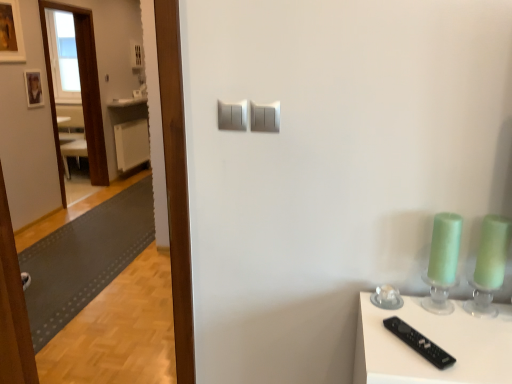
Question: Can you confirm if transparent wooden door at left is smaller than wooden picture frame at upper left, the 1th picture frame when ordered from front to back?

Choices:
 (A) yes
 (B) no

Answer: (B)

Question: Does transparent wooden door at left have a lesser width compared to wooden picture frame at upper left, the 1th picture frame when ordered from front to back?

Choices:
 (A) yes
 (B) no

Answer: (B)

Question: From the image's perspective, would you say transparent wooden door at left is shown under wooden picture frame at upper left, marked as the second picture frame in a bottom-to-top arrangement?

Choices:
 (A) yes
 (B) no

Answer: (A)

Question: Does transparent wooden door at left have a larger size compared to wooden picture frame at upper left, placed as the second picture frame when sorted from back to front?

Choices:
 (A) no
 (B) yes

Answer: (B)

Question: Considering the relative positions of transparent wooden door at left and wooden picture frame at upper left, the 1th picture frame when ordered from front to back, in the image provided, is transparent wooden door at left to the left of wooden picture frame at upper left, the 1th picture frame when ordered from front to back, from the viewer's perspective?

Choices:
 (A) yes
 (B) no

Answer: (B)

Question: Is wooden photo frame at upper left, the first picture frame ordered from the bottom, situated inside wooden picture frame at upper left, which is counted as the 1th picture frame, starting from the top, or outside?

Choices:
 (A) inside
 (B) outside

Answer: (B)

Question: Considering their positions, is wooden photo frame at upper left, the first picture frame ordered from the bottom, located in front of or behind wooden picture frame at upper left, placed as the second picture frame when sorted from back to front?

Choices:
 (A) behind
 (B) front

Answer: (A)

Question: From a real-world perspective, relative to wooden picture frame at upper left, which is counted as the 1th picture frame, starting from the top, is wooden photo frame at upper left, the first picture frame when ordered from back to front, vertically above or below?

Choices:
 (A) above
 (B) below

Answer: (B)

Question: Visually, is wooden photo frame at upper left, which ranks as the 2th picture frame in front-to-back order, positioned to the left or to the right of wooden picture frame at upper left, marked as the second picture frame in a bottom-to-top arrangement?

Choices:
 (A) right
 (B) left

Answer: (A)

Question: Is white plastic radiator at left wider or thinner than black plastic remote at lower right?

Choices:
 (A) wide
 (B) thin

Answer: (B)

Question: From the image's perspective, is white plastic radiator at left positioned above or below black plastic remote at lower right?

Choices:
 (A) below
 (B) above

Answer: (B)

Question: Considering the positions of white plastic radiator at left and black plastic remote at lower right in the image, is white plastic radiator at left taller or shorter than black plastic remote at lower right?

Choices:
 (A) short
 (B) tall

Answer: (B)

Question: Do you think white plastic radiator at left is within black plastic remote at lower right, or outside of it?

Choices:
 (A) outside
 (B) inside

Answer: (A)

Question: Considering the positions of white plastic radiator at left and wooden picture frame at upper left, which is counted as the 1th picture frame, starting from the top, in the image, is white plastic radiator at left taller or shorter than wooden picture frame at upper left, which is counted as the 1th picture frame, starting from the top,?

Choices:
 (A) tall
 (B) short

Answer: (A)

Question: Would you say white plastic radiator at left is inside or outside wooden picture frame at upper left, marked as the second picture frame in a bottom-to-top arrangement?

Choices:
 (A) outside
 (B) inside

Answer: (A)